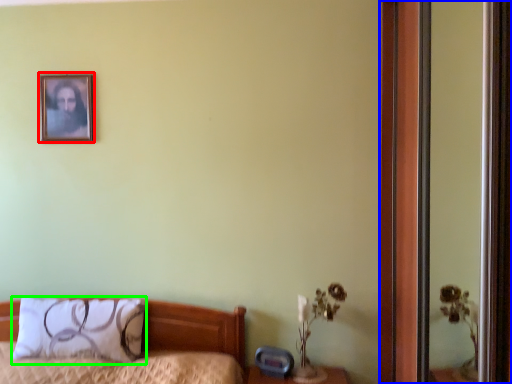
Question: Based on their relative distances, which object is farther from picture frame (highlighted by a red box)? Choose from screen door (highlighted by a blue box) and pillow (highlighted by a green box).

Choices:
 (A) screen door
 (B) pillow

Answer: (A)